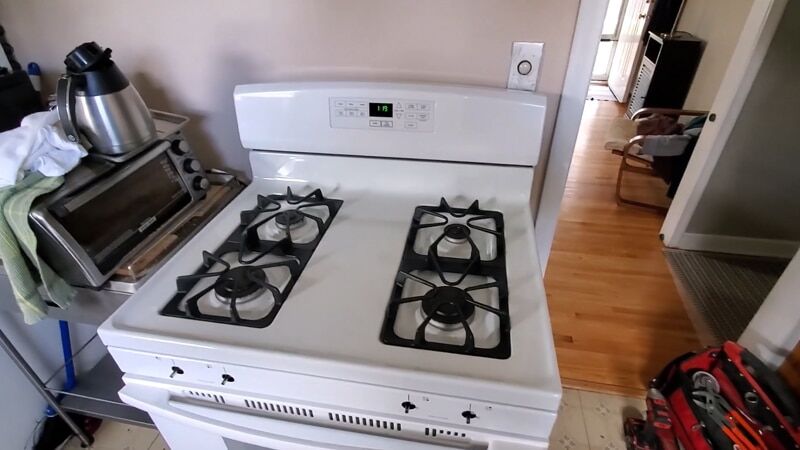
Identify the location of knobs. (182, 143), (196, 165), (200, 188).